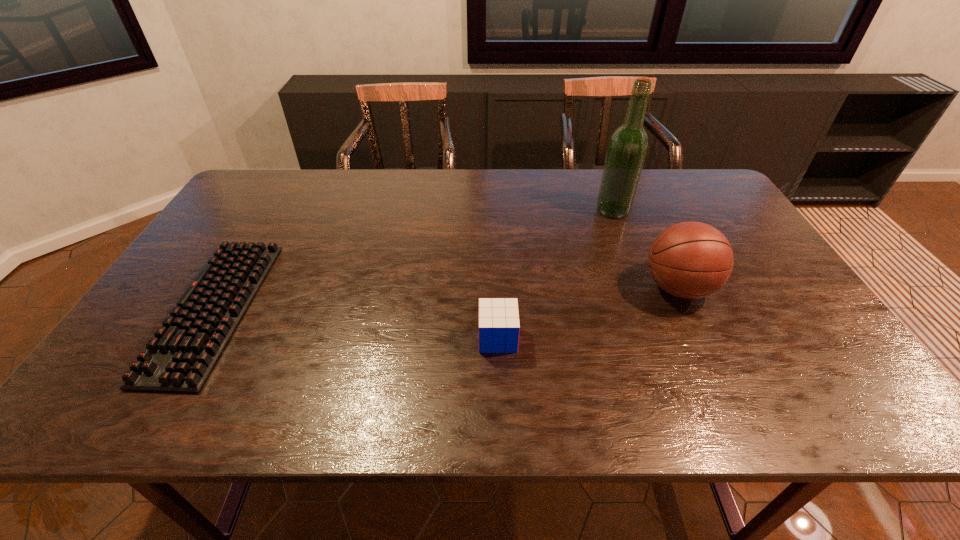
Where is `vacant space situated on the right of the computer keyboard`? The width and height of the screenshot is (960, 540). vacant space situated on the right of the computer keyboard is located at coordinates (356, 309).

At what (x,y) coordinates should I click in order to perform the action: click on object located in the far edge section of the desktop. Please return your answer as a coordinate pair (x, y). This screenshot has height=540, width=960. Looking at the image, I should click on (628, 145).

The height and width of the screenshot is (540, 960). I want to click on object situated at the near edge, so click(x=180, y=358).

Locate an element on the screen. This screenshot has width=960, height=540. object located at the left edge is located at coordinates (180, 358).

Locate an element on the screen. The height and width of the screenshot is (540, 960). object located in the near left corner section of the desktop is located at coordinates (180, 358).

Find the location of a particular element. vacant region at the far edge of the desktop is located at coordinates (324, 199).

You are a GUI agent. You are given a task and a screenshot of the screen. Output one action in this format:
    pyautogui.click(x=<x>, y=<y>)
    Task: Click on the vacant space at the near edge of the desktop
    Image resolution: width=960 pixels, height=540 pixels.
    Given the screenshot: What is the action you would take?
    pyautogui.click(x=632, y=402)

Locate an element on the screen. The height and width of the screenshot is (540, 960). blank space at the left edge is located at coordinates (112, 379).

In the image, there is a desktop. What are the coordinates of `vacant space at the right edge` in the screenshot? It's located at (805, 374).

In the image, there is a desktop. At what (x,y) coordinates should I click in order to perform the action: click on vacant space at the near left corner. Please return your answer as a coordinate pair (x, y). Image resolution: width=960 pixels, height=540 pixels. Looking at the image, I should click on (110, 401).